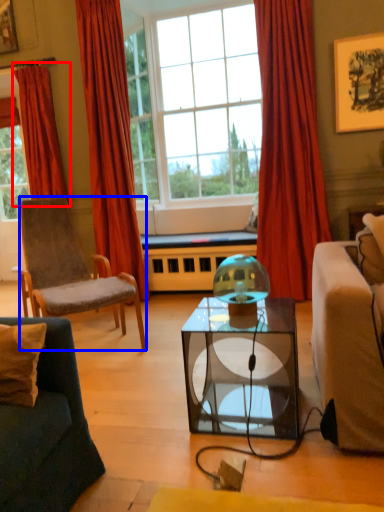
Question: Among these objects, which one is farthest to the camera, curtain (highlighted by a red box) or chair (highlighted by a blue box)?

Choices:
 (A) curtain
 (B) chair

Answer: (A)